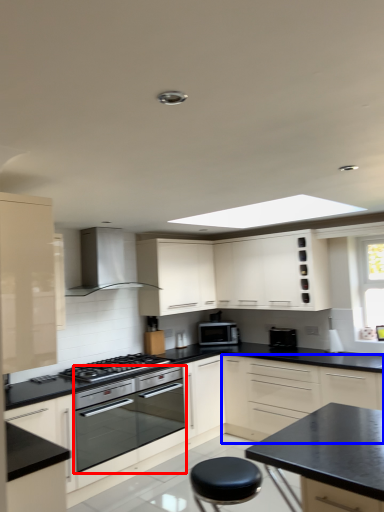
Question: Which object appears farthest to the camera in this image, oven (highlighted by a red box) or cabinetry (highlighted by a blue box)?

Choices:
 (A) oven
 (B) cabinetry

Answer: (A)